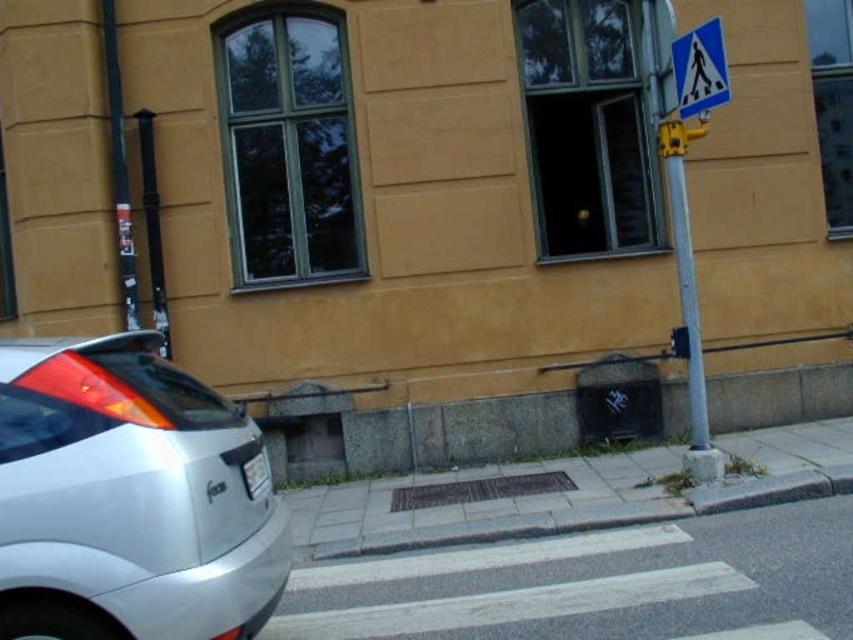
Does yellow metallic pole at right have a greater height compared to yellow plastic traffic light at upper right?

Yes.

Can you confirm if yellow metallic pole at right is positioned above yellow plastic traffic light at upper right?

Incorrect, yellow metallic pole at right is not positioned above yellow plastic traffic light at upper right.

Who is more distant from viewer, (698, 378) or (688, 131)?

Positioned behind is point (698, 378).

Locate an element on the screen. The width and height of the screenshot is (853, 640). yellow metallic pole at right is located at coordinates (688, 296).

Can you confirm if silver metallic hatchback at lower left is shorter than blue plastic pedestrian crossing sign at upper right?

No, silver metallic hatchback at lower left is not shorter than blue plastic pedestrian crossing sign at upper right.

Which is behind, point (184, 536) or point (688, 56)?

The point (688, 56) is behind.

In order to click on silver metallic hatchback at lower left in this screenshot , I will do `click(128, 499)`.

What do you see at coordinates (128, 499) in the screenshot? This screenshot has height=640, width=853. I see `silver metallic hatchback at lower left` at bounding box center [128, 499].

Does silver metallic hatchback at lower left come in front of brass textured grate at center?

That is True.

Where is `silver metallic hatchback at lower left`? The height and width of the screenshot is (640, 853). silver metallic hatchback at lower left is located at coordinates (128, 499).